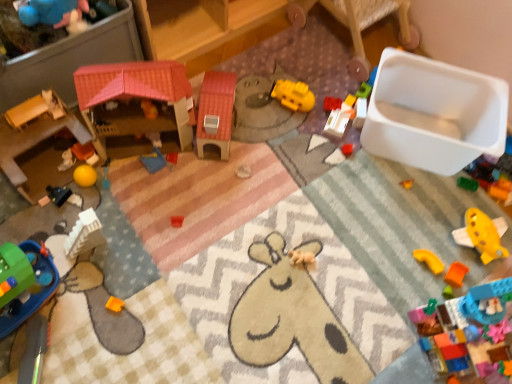
The height and width of the screenshot is (384, 512). I want to click on free space behind yellow matte plastic arch at lower right, acting as the 4th toy starting from the right, so click(x=422, y=217).